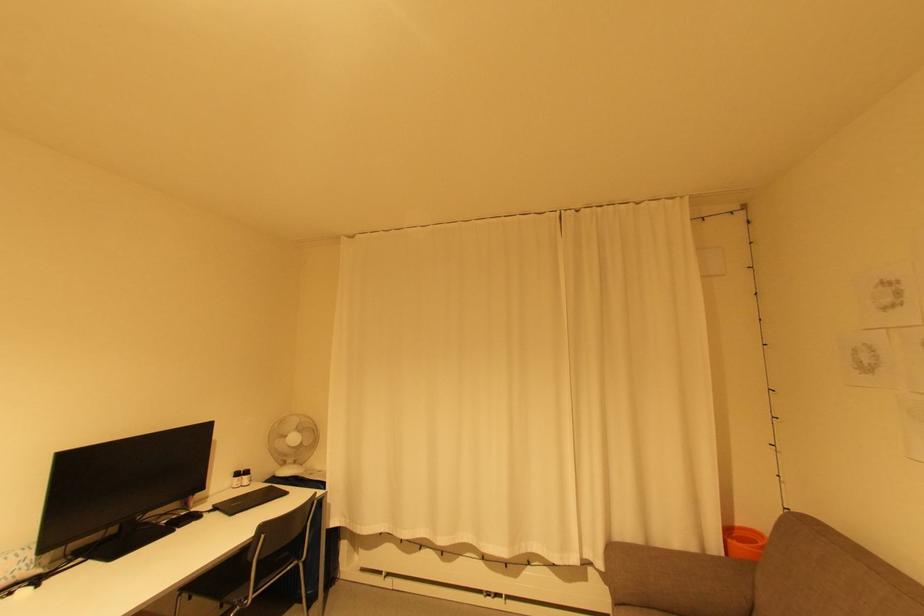
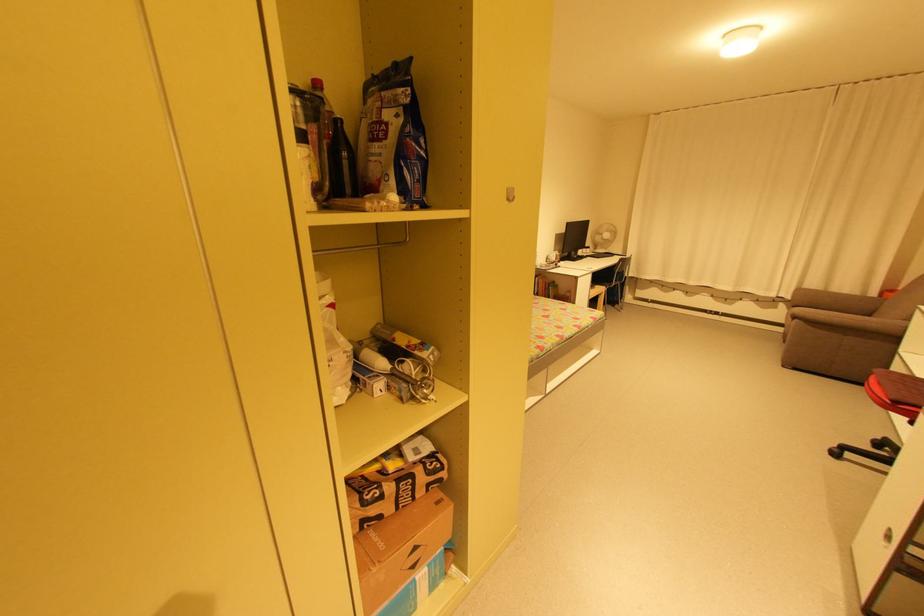
In the second image, find the point that corresponds to the point at 604,565 in the first image.

(794, 297)